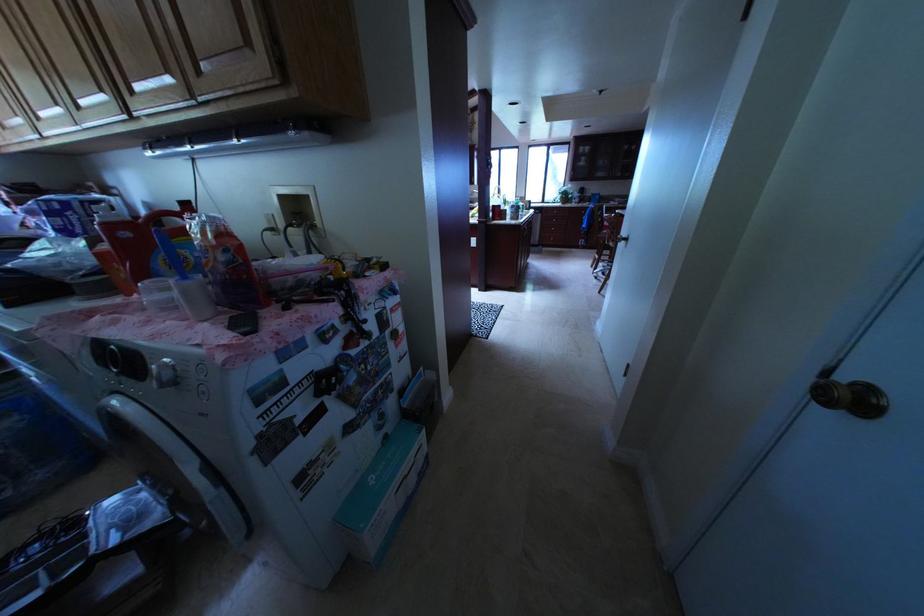
At what (x,y) coordinates should I click in order to perform the action: click on wooden cabinet handle. Please return your answer as a coordinate pair (x, y). This screenshot has height=616, width=924. Looking at the image, I should click on (619, 241).